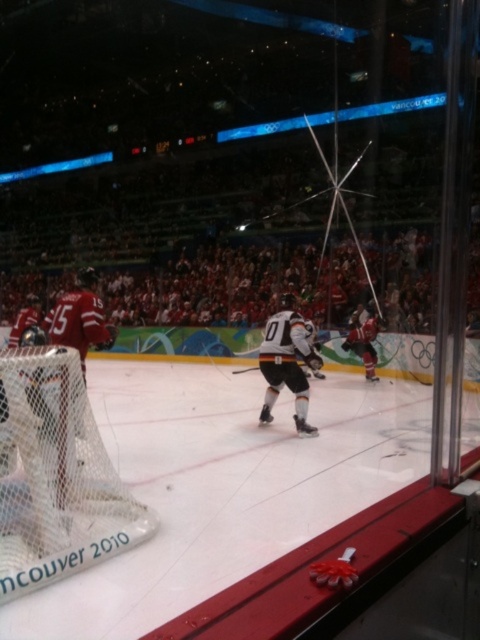
Question: Is matte red jersey at right wider than black matte hockey stick at center?

Choices:
 (A) no
 (B) yes

Answer: (A)

Question: Which object appears farthest from the camera in this image?

Choices:
 (A) black matte hockey stick at center
 (B) matte red jersey at right

Answer: (B)

Question: Is white jersey at center above matte red jersey at right?

Choices:
 (A) no
 (B) yes

Answer: (A)

Question: Among these objects, which one is nearest to the camera?

Choices:
 (A) white jersey at center
 (B) black matte hockey stick at center

Answer: (A)

Question: Estimate the real-world distances between objects in this image. Which object is closer to the black matte hockey stick at center?

Choices:
 (A) white jersey at center
 (B) matte red jersey at right

Answer: (B)

Question: Can you confirm if white jersey at center is bigger than black matte hockey stick at center?

Choices:
 (A) yes
 (B) no

Answer: (B)